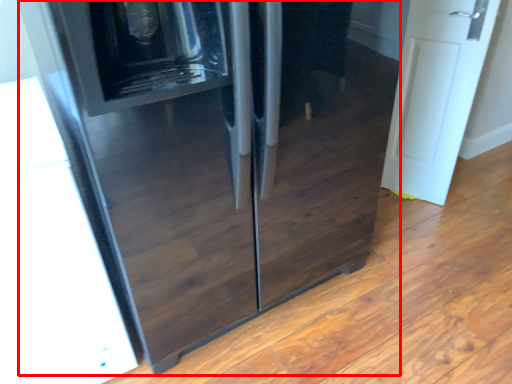
Question: From the image's perspective, where is refrigerator (annotated by the red box) located in relation to door in the image?

Choices:
 (A) below
 (B) above

Answer: (A)